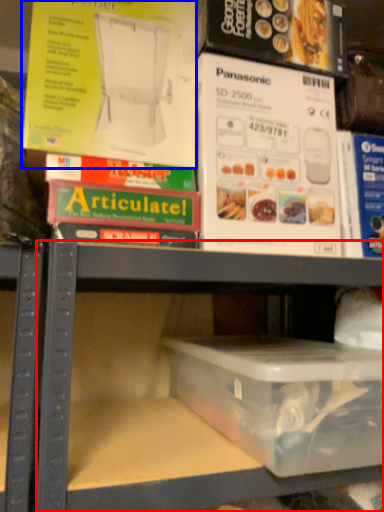
Question: Which of the following is the closest to the observer, shelf (highlighted by a red box) or paperback book (highlighted by a blue box)?

Choices:
 (A) shelf
 (B) paperback book

Answer: (A)